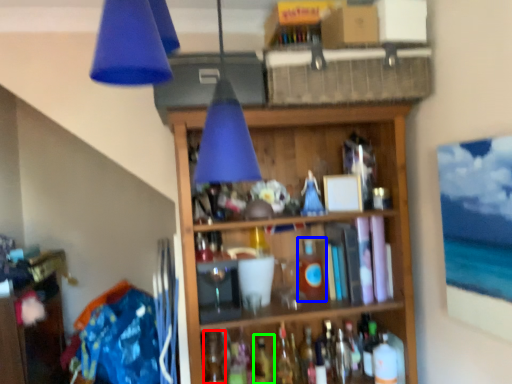
Question: Considering the real-world distances, which object is closest to bottle (highlighted by a red box)? bottle (highlighted by a blue box) or wine bottle (highlighted by a green box).

Choices:
 (A) bottle
 (B) wine bottle

Answer: (B)